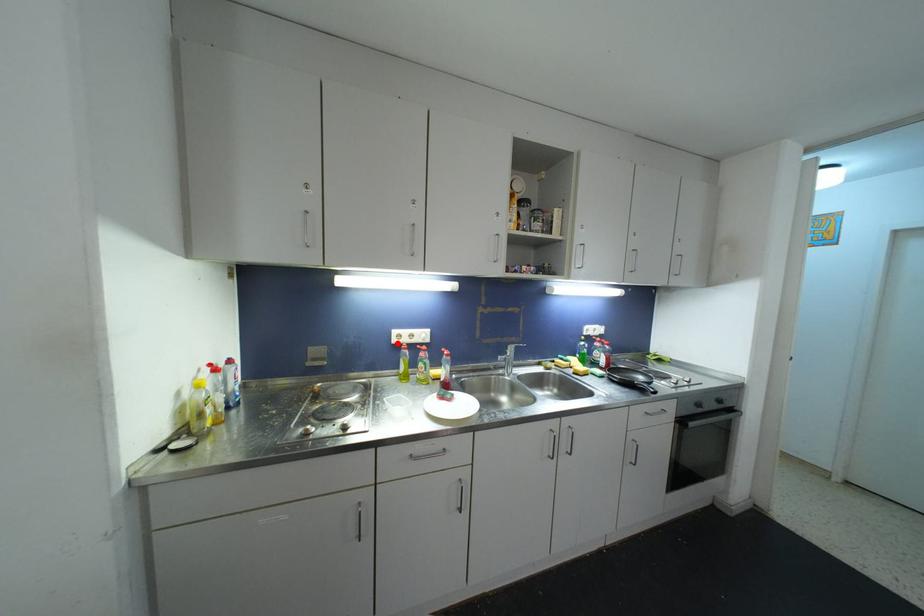
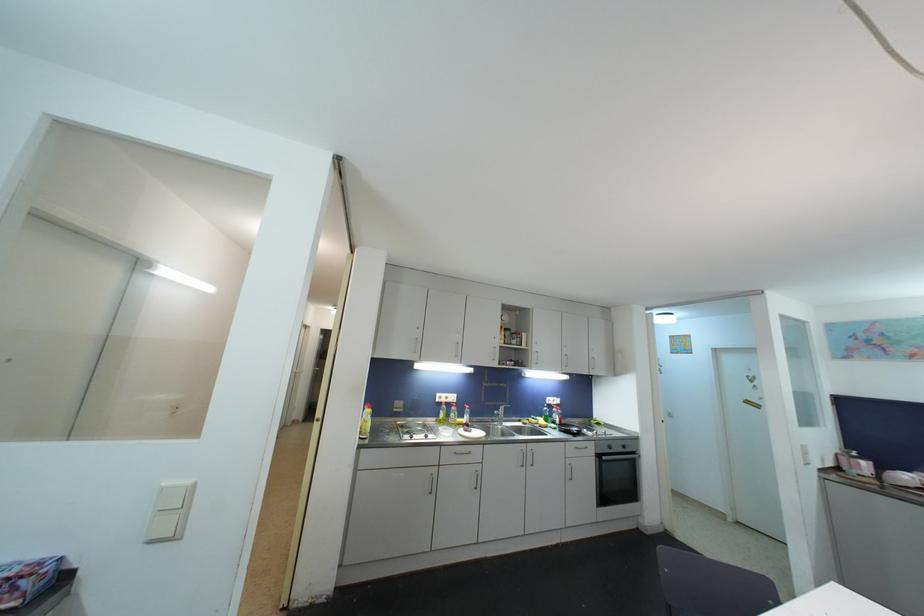
Question: I am providing you with two images of the same scene from different viewpoints. In image1, a red point is highlighted. Considering the same 3D point in image2, which of the following is correct?

Choices:
 (A) It is closer
 (B) It is farther

Answer: (B)